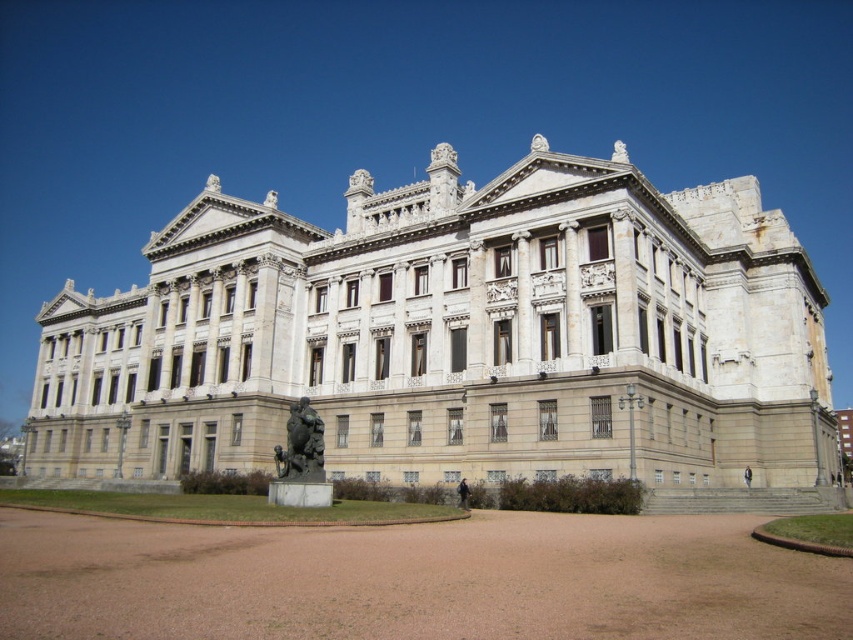
Can you confirm if white marble palace at center is positioned to the left of bronze statue at center?

Yes, white marble palace at center is to the left of bronze statue at center.

Locate an element on the screen. The height and width of the screenshot is (640, 853). white marble palace at center is located at coordinates (454, 336).